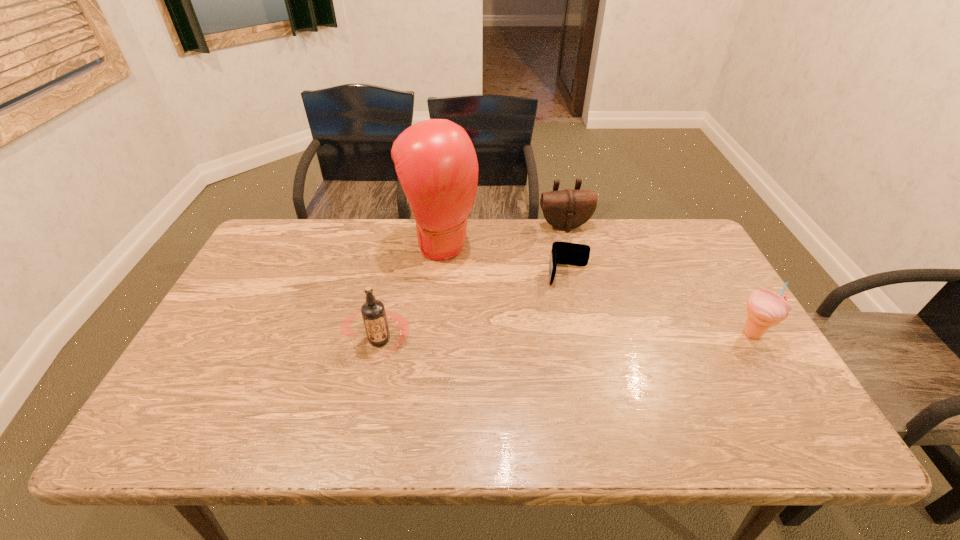
What are the coordinates of `free location located on the striking surface of the boxing glove` in the screenshot? It's located at (474, 284).

Locate an element on the screen. The image size is (960, 540). vacant space located 0.060m on the striking surface of the boxing glove is located at coordinates (468, 278).

Where is `vacant area located 0.180m on the striking surface of the boxing glove`? This screenshot has height=540, width=960. vacant area located 0.180m on the striking surface of the boxing glove is located at coordinates (490, 303).

This screenshot has width=960, height=540. I want to click on vacant point located 0.140m with the flap open on the pouch, so click(580, 260).

Where is `vacant space situated with the flap open on the pouch`? This screenshot has height=540, width=960. vacant space situated with the flap open on the pouch is located at coordinates (599, 309).

This screenshot has width=960, height=540. In order to click on vacant space situated 0.370m with the flap open on the pouch in this screenshot , I will do `click(601, 314)`.

Locate an element on the screen. The width and height of the screenshot is (960, 540). wallet situated at the far edge is located at coordinates (567, 253).

Locate an element on the screen. This screenshot has height=540, width=960. boxing glove that is positioned at the far edge is located at coordinates (435, 161).

Identify the location of pouch located at the far edge. (567, 209).

Find the location of `object that is at the right edge`. object that is at the right edge is located at coordinates (765, 308).